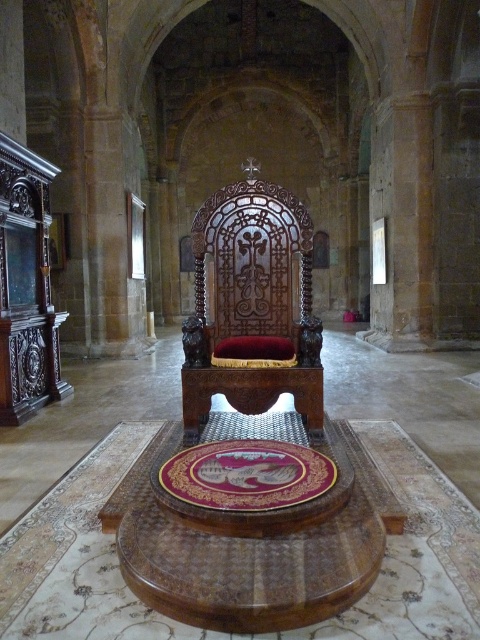
Question: Among these points, which one is nearest to the camera?

Choices:
 (A) (219, 380)
 (B) (168, 563)
 (C) (297, 509)

Answer: (B)

Question: Which of the following is the farthest from the observer?

Choices:
 (A) (142, 582)
 (B) (307, 406)

Answer: (B)

Question: Does polished wood round table at center appear over gold-carved table at center?

Choices:
 (A) no
 (B) yes

Answer: (A)

Question: Is polished wood throne at center above polished wood round table at center?

Choices:
 (A) yes
 (B) no

Answer: (A)

Question: Among these points, which one is nearest to the camera?

Choices:
 (A) (298, 470)
 (B) (235, 346)

Answer: (A)

Question: Can you confirm if polished wood round table at center is positioned to the right of gold-carved table at center?

Choices:
 (A) no
 (B) yes

Answer: (B)